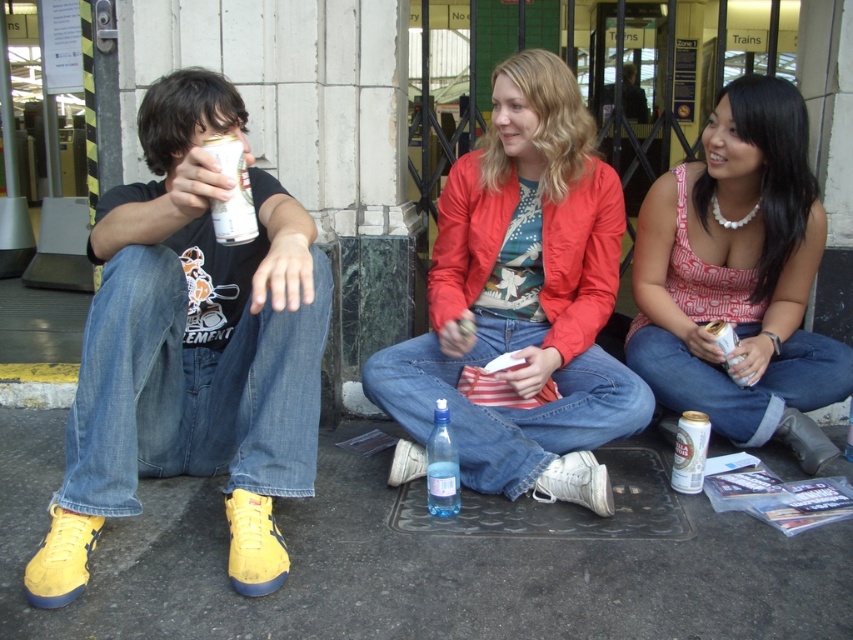
Question: Which object is the closest to the gold metallic can at lower right?

Choices:
 (A) smooth concrete pavement at lower center
 (B) silver metallic can at left
 (C) transparent plastic bottle at center

Answer: (C)

Question: Does matte red jacket at center appear over pearl necklace at upper right?

Choices:
 (A) no
 (B) yes

Answer: (A)

Question: Which point is closer to the camera?

Choices:
 (A) pearl necklace at upper right
 (B) smooth concrete pavement at lower center
 (C) silver metallic can at left
 (D) gold metallic can at lower right

Answer: (C)

Question: Estimate the real-world distances between objects in this image. Which object is farther from the yellow suede sneakers at left?

Choices:
 (A) pearl necklace at upper right
 (B) matte red jacket at center

Answer: (A)

Question: Is pearl necklace at upper right positioned behind transparent plastic bottle at center?

Choices:
 (A) no
 (B) yes

Answer: (B)

Question: Is smooth concrete pavement at lower center to the right of gold metallic can at lower right from the viewer's perspective?

Choices:
 (A) yes
 (B) no

Answer: (B)